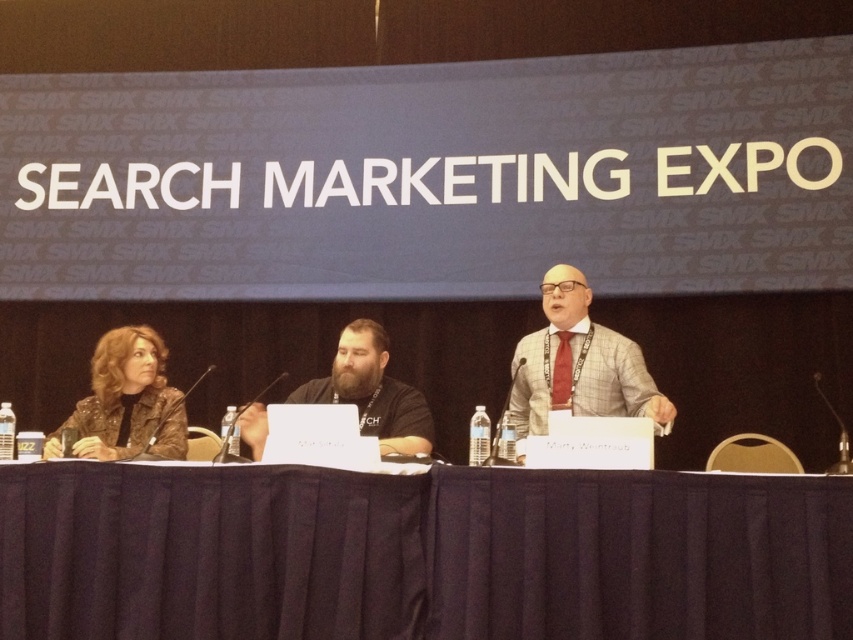
Question: Among these points, which one is farthest from the camera?

Choices:
 (A) (370, 378)
 (B) (99, 420)

Answer: (A)

Question: Observing the image, what is the correct spatial positioning of black fabric table at center in reference to gray checkered suit at center?

Choices:
 (A) below
 (B) above

Answer: (A)

Question: Estimate the real-world distances between objects in this image. Which object is closer to the black fabric table at center?

Choices:
 (A) black matte shirt at center
 (B) sparkly black jacket at left
 (C) gray checkered suit at center

Answer: (B)

Question: Does sparkly black jacket at left have a smaller size compared to black matte shirt at center?

Choices:
 (A) no
 (B) yes

Answer: (B)

Question: Where is gray checkered suit at center located in relation to black matte shirt at center in the image?

Choices:
 (A) right
 (B) left

Answer: (A)

Question: Which of the following is the farthest from the observer?

Choices:
 (A) (421, 397)
 (B) (744, 557)
 (C) (141, 380)
 (D) (561, 339)

Answer: (D)